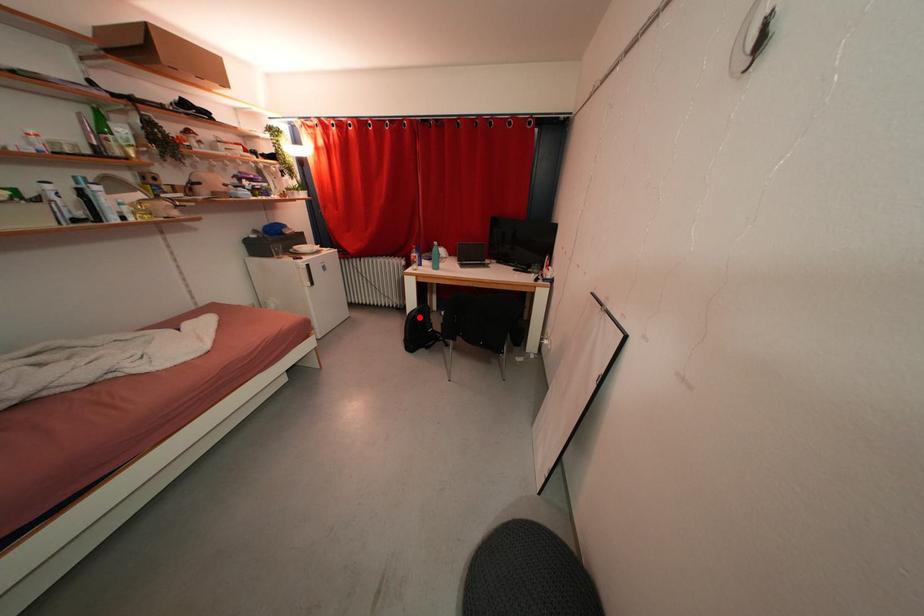
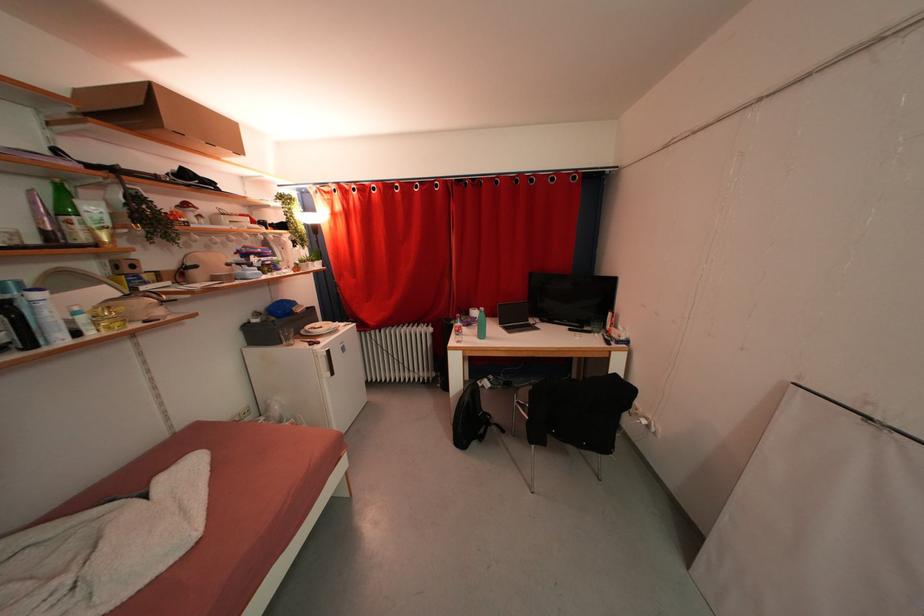
Question: I am providing you with two images of the same scene from different viewpoints. In image1, a red point is highlighted. Considering the same 3D point in image2, which of the following is correct?

Choices:
 (A) It is closer
 (B) It is farther

Answer: (A)